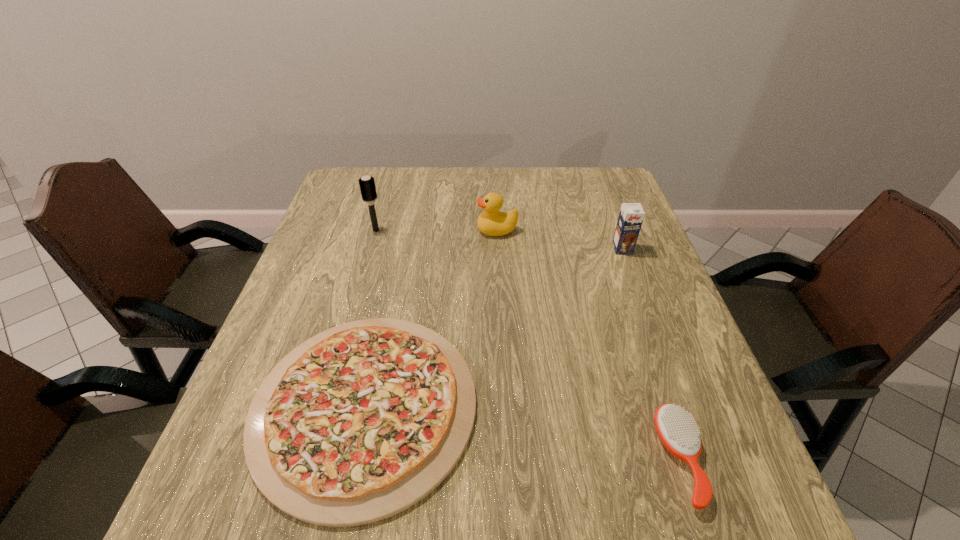
Image resolution: width=960 pixels, height=540 pixels. What are the coordinates of `blank area in the image that satisfies the following two spatial constraints: 1. on the front side of the second shortest object; 2. on the left side of the left hairbrush` in the screenshot? It's located at (311, 459).